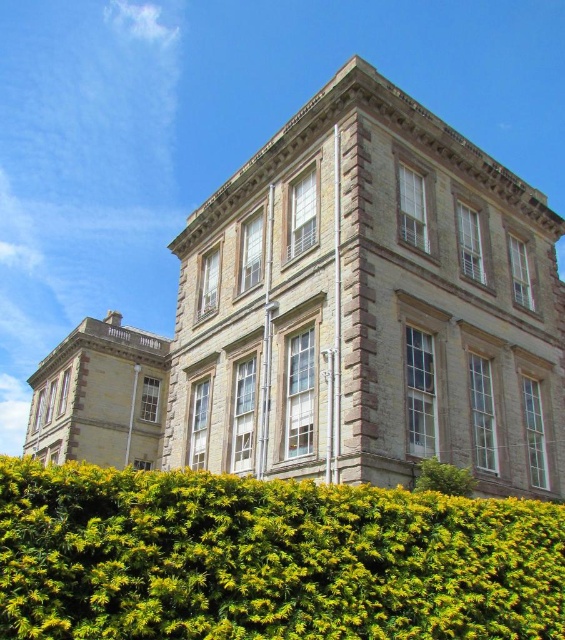
You are standing in front of the historic building and notice two points marked on the facade. The first point is at coordinates point [234,586] and the second at point [452,493]. Which point is closer to your current position?

Point [234,586] is closer to the camera than point [452,493], so the first point is closer to your current position.

You are a landscape architect designing a garden path between the green leafy hedge at lower center and the green leafy hedge at lower right. Which hedge is wider, requiring more space in the garden design?

The green leafy hedge at lower center is wider than the green leafy hedge at lower right, so it requires more space in the garden design.

You are standing at the entrance of the historic building and want to plant a new tree in the garden. The garden has a green leafy hedge at lower center. Where exactly should you place the new tree so it doesn not block the view of the hedge from the entrance?

The green leafy hedge at lower center is located at coordinates point (267,560). To avoid blocking the view of the hedge from the entrance, the new tree should be placed behind or to the side of the hedge, ensuring it does not obstruct the line of sight from the entrance to the hedge.